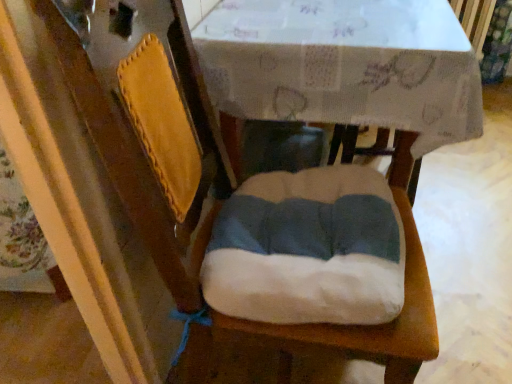
Question: Do you think white paper at center is within white fabric cushion at center, or outside of it?

Choices:
 (A) inside
 (B) outside

Answer: (B)

Question: From their relative heights in the image, would you say white paper at center is taller or shorter than white fabric cushion at center?

Choices:
 (A) tall
 (B) short

Answer: (A)

Question: Does point (419, 34) appear closer or farther from the camera than point (426, 342)?

Choices:
 (A) farther
 (B) closer

Answer: (A)

Question: From a real-world perspective, is white fabric cushion at center positioned above or below white paper at center?

Choices:
 (A) above
 (B) below

Answer: (B)

Question: Looking at their shapes, would you say white fabric cushion at center is wider or thinner than white paper at center?

Choices:
 (A) thin
 (B) wide

Answer: (B)

Question: Is point (364, 327) positioned closer to the camera than point (354, 51)?

Choices:
 (A) farther
 (B) closer

Answer: (B)

Question: Considering their positions, is white fabric cushion at center located in front of or behind white paper at center?

Choices:
 (A) front
 (B) behind

Answer: (B)